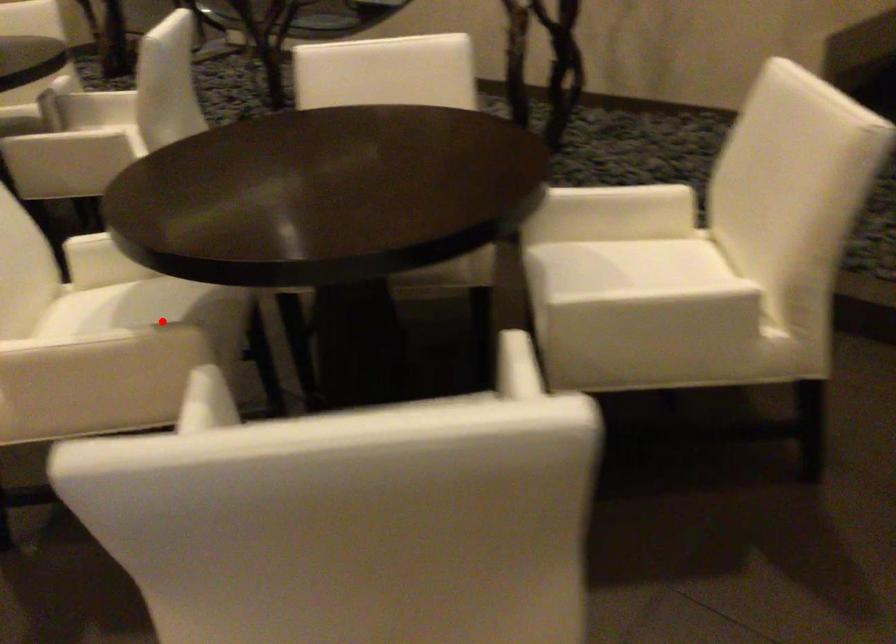
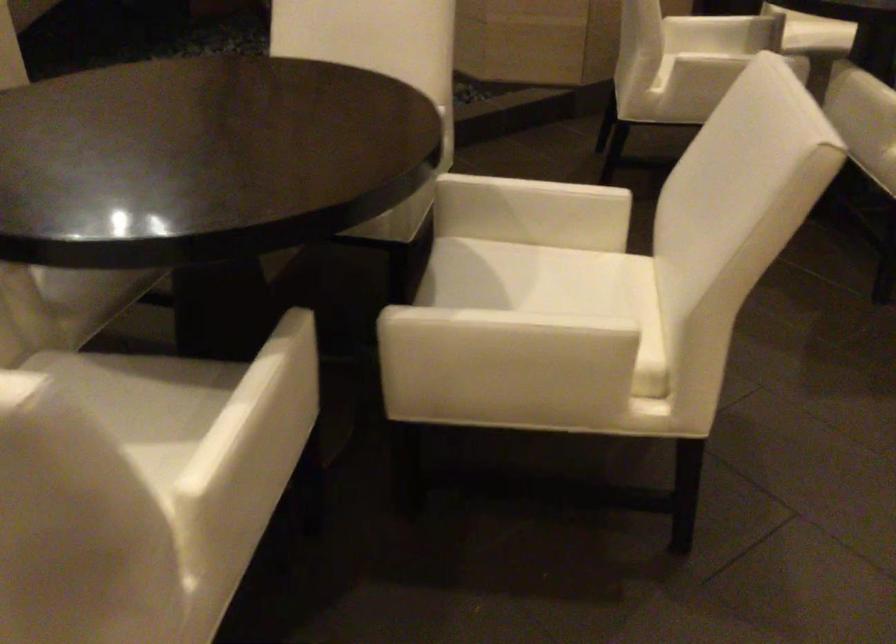
Question: I am providing you with two images of the same scene from different viewpoints. A red point is marked on the first image. Can you still see the location of the red point in image 2?

Choices:
 (A) Yes
 (B) No

Answer: (A)